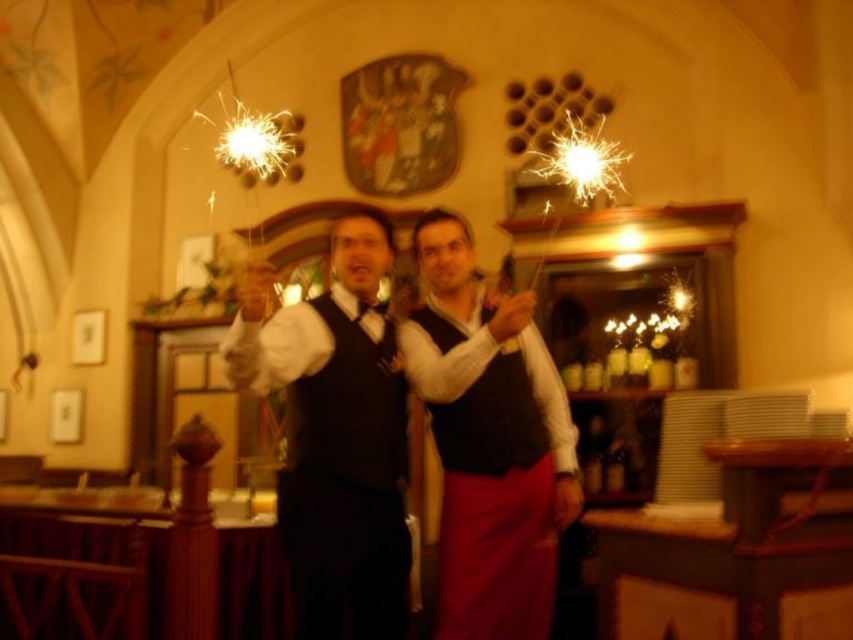
Is matte black vests at center behind matte black vest at center?

That is False.

Is point (308, 323) behind point (392, 342)?

No.

At what (x,y) coordinates should I click in order to perform the action: click on matte black vests at center. Please return your answer as a coordinate pair (x, y). The width and height of the screenshot is (853, 640). Looking at the image, I should click on (335, 433).

From the picture: Does matte black vest at center have a smaller size compared to black velvet vest at center?

Actually, matte black vest at center might be larger than black velvet vest at center.

Who is higher up, matte black vest at center or black velvet vest at center?

Positioned higher is matte black vest at center.

Which is in front, point (360, 340) or point (492, 461)?

Point (492, 461)

Locate an element on the screen. This screenshot has width=853, height=640. matte black vest at center is located at coordinates (350, 408).

Does matte black vests at center have a lesser width compared to black velvet vest at center?

No, matte black vests at center is not thinner than black velvet vest at center.

Between matte black vests at center and black velvet vest at center, which one appears on the left side from the viewer's perspective?

Positioned to the left is matte black vests at center.

Does point (300, 381) come in front of point (506, 436)?

Yes, point (300, 381) is in front of point (506, 436).

Locate an element on the screen. The width and height of the screenshot is (853, 640). matte black vests at center is located at coordinates click(x=335, y=433).